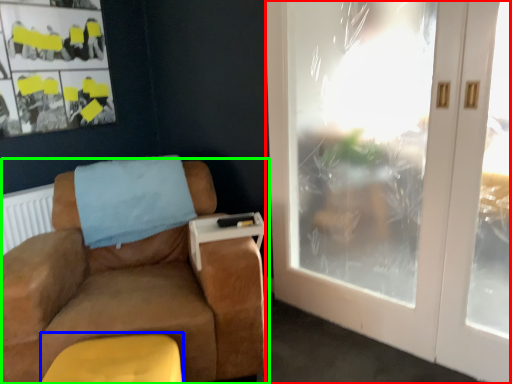
Question: Which object is positioned closest to door (highlighted by a red box)? Select from footrest (highlighted by a blue box) and chair (highlighted by a green box).

Choices:
 (A) footrest
 (B) chair

Answer: (B)